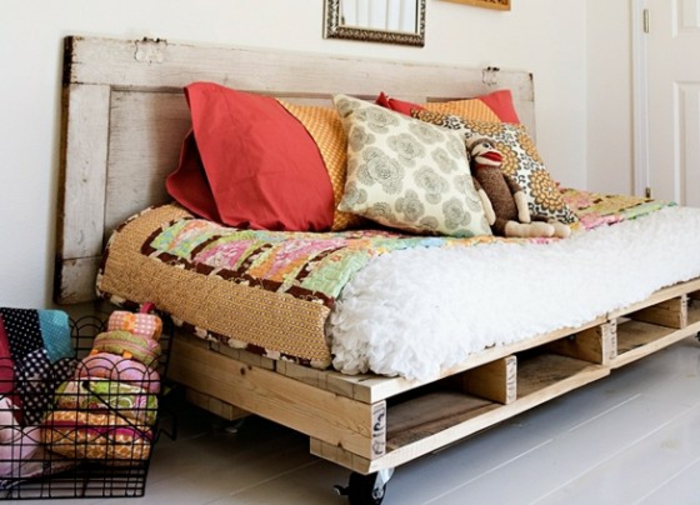
Find the location of a particular element. door hinges is located at coordinates (x=643, y=20), (x=645, y=191).